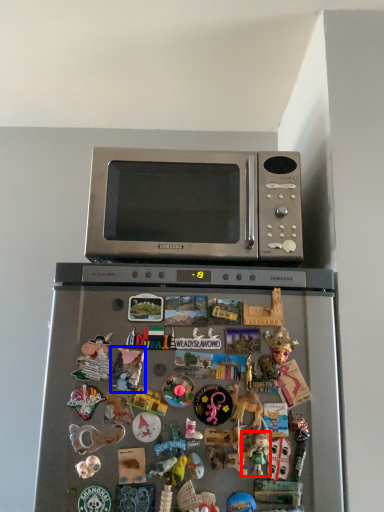
Question: Among these objects, which one is nearest to the camera, toy (highlighted by a red box) or toy (highlighted by a blue box)?

Choices:
 (A) toy
 (B) toy

Answer: (A)